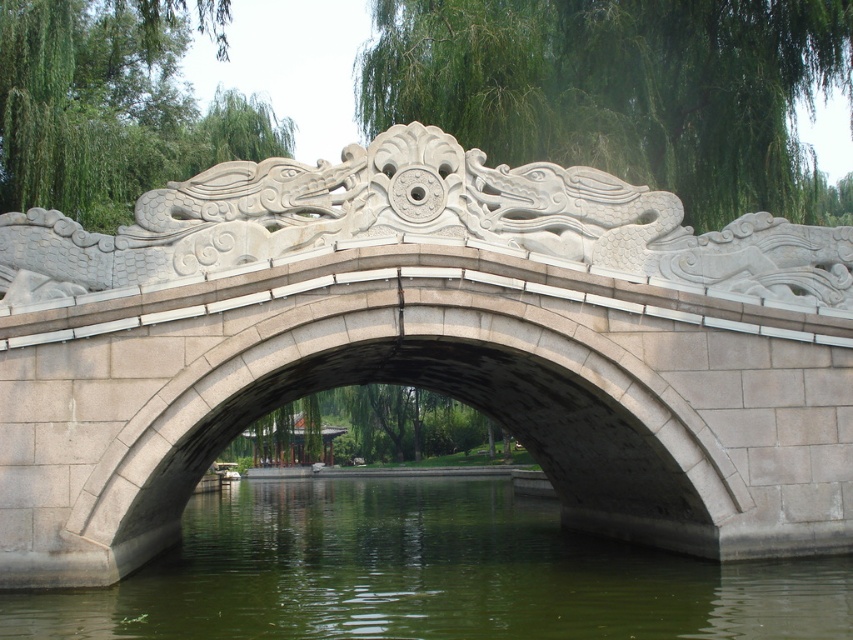
Does white stone bridge at center appear over green stone water at center?

Yes.

Which is in front, point (628, 320) or point (398, 588)?

Positioned in front is point (628, 320).

Image resolution: width=853 pixels, height=640 pixels. In order to click on white stone bridge at center in this screenshot , I will do `click(425, 346)`.